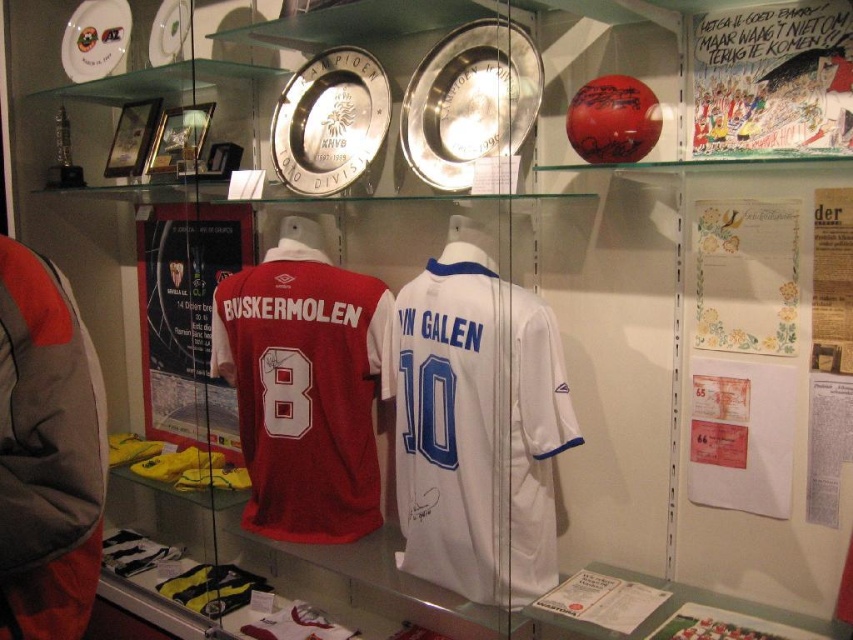
Question: Which object is farther from the camera taking this photo?

Choices:
 (A) white fabric jersey at center
 (B) white jersey at center
 (C) brushed metal baseball uniform at left
 (D) matte jersey at center

Answer: (D)

Question: Does matte jersey at center come behind brushed metal baseball uniform at left?

Choices:
 (A) no
 (B) yes

Answer: (B)

Question: Is white jersey at center thinner than white fabric jersey at center?

Choices:
 (A) no
 (B) yes

Answer: (A)

Question: Which object appears closest to the camera in this image?

Choices:
 (A) white jersey at center
 (B) brushed metal baseball uniform at left
 (C) matte jersey at center
 (D) white fabric jersey at center

Answer: (B)

Question: Is matte jersey at center above white fabric jersey at center?

Choices:
 (A) yes
 (B) no

Answer: (A)

Question: Which point is farther from the camera taking this photo?

Choices:
 (A) (262, 506)
 (B) (402, 378)

Answer: (A)